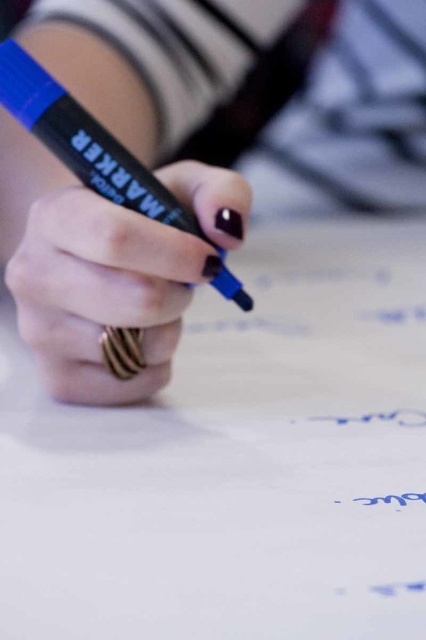
Question: Is the position of blue marker at center more distant than that of matte black marker at center?

Choices:
 (A) yes
 (B) no

Answer: (A)

Question: Is blue marker at center to the left of matte black marker at center from the viewer's perspective?

Choices:
 (A) yes
 (B) no

Answer: (B)

Question: Which of the following is the closest to the observer?

Choices:
 (A) (141, 221)
 (B) (176, 176)

Answer: (A)

Question: Can you confirm if blue marker at center is positioned above matte black marker at center?

Choices:
 (A) yes
 (B) no

Answer: (A)

Question: Which of the following is the closest to the observer?

Choices:
 (A) (192, 253)
 (B) (189, 170)

Answer: (A)